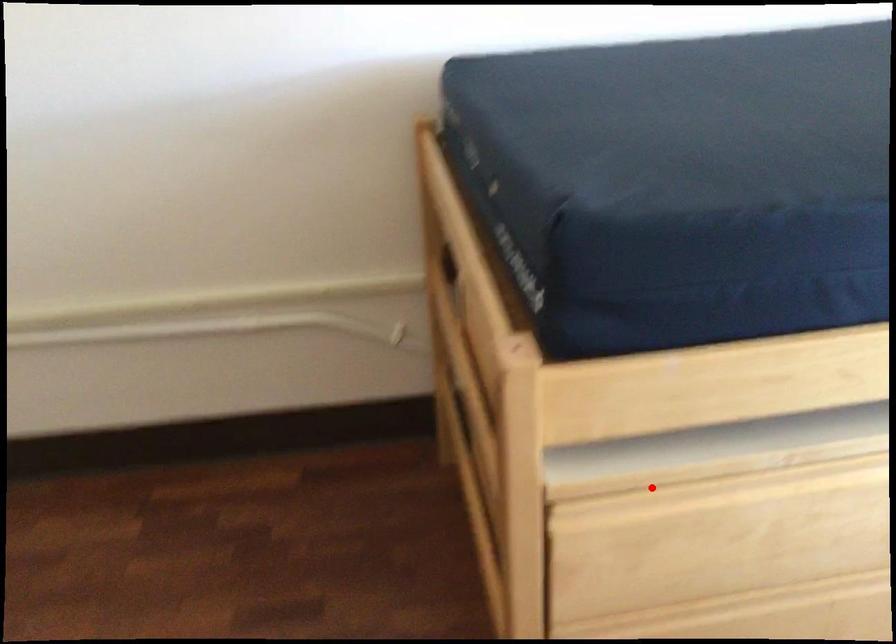
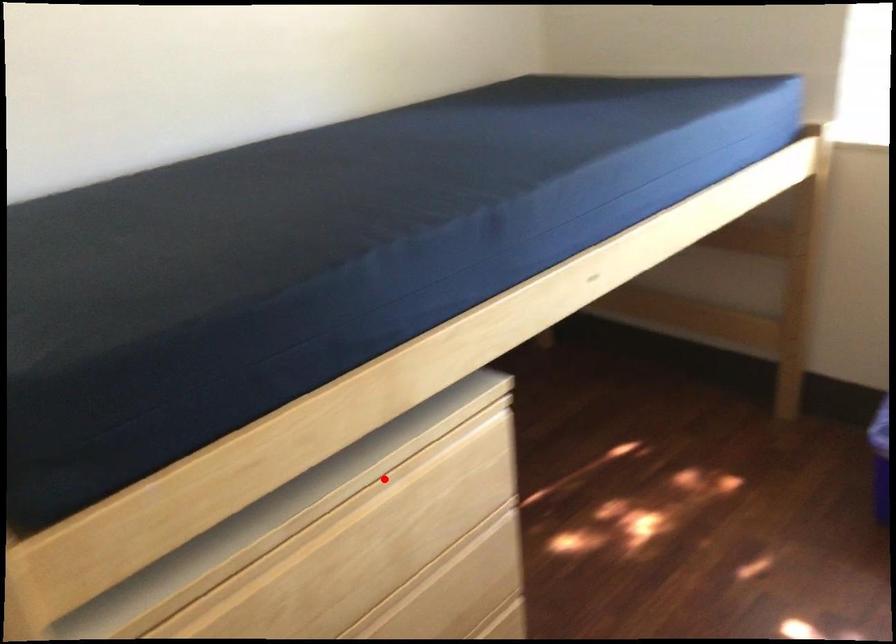
I am providing you with two images of the same scene from different viewpoints. A red point is marked on the first image and another point is marked on the second image. Does the point marked in image1 correspond to the same location as the one in image2?

No